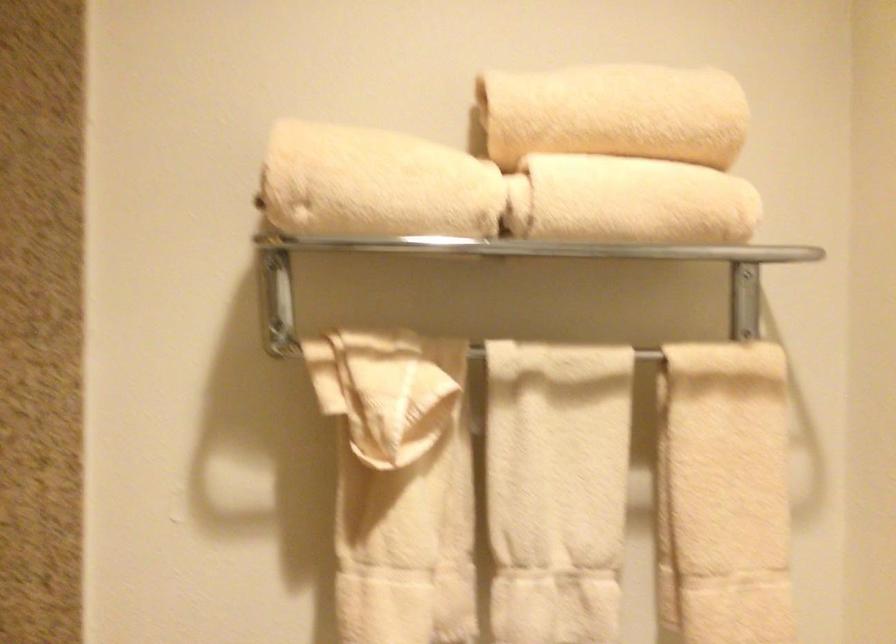
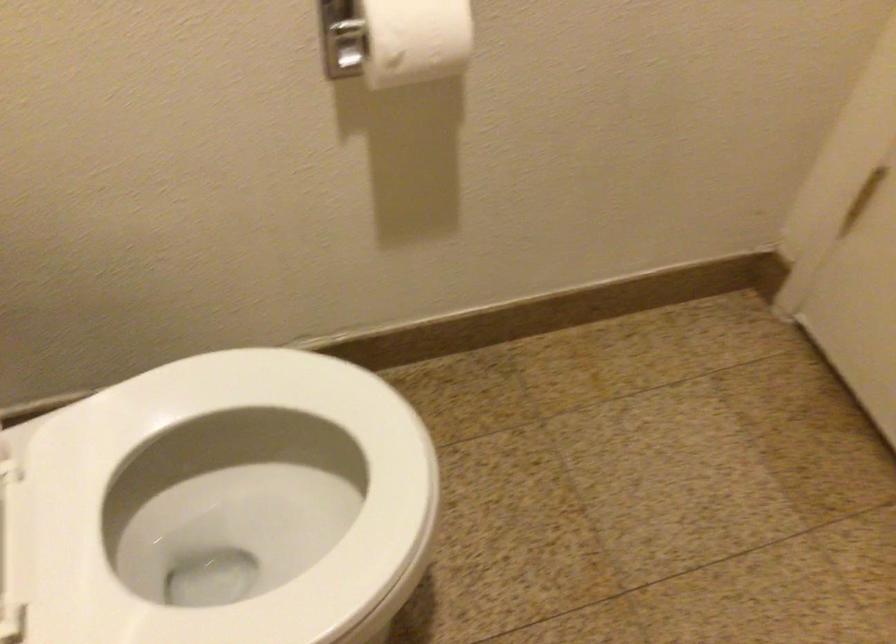
From the picture: First-person continuous shooting, in which direction is the camera rotating?

The camera's rotation is toward right-down.